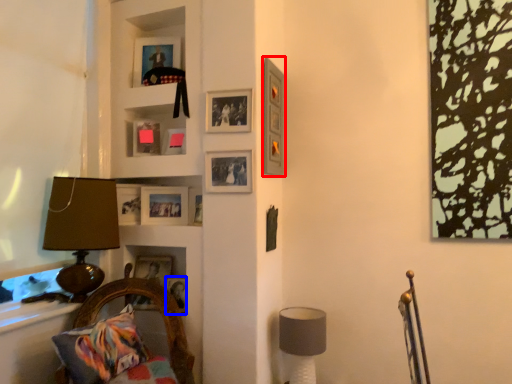
Question: Which point is further to the camera, picture frame (highlighted by a red box) or picture frame (highlighted by a blue box)?

Choices:
 (A) picture frame
 (B) picture frame

Answer: (B)